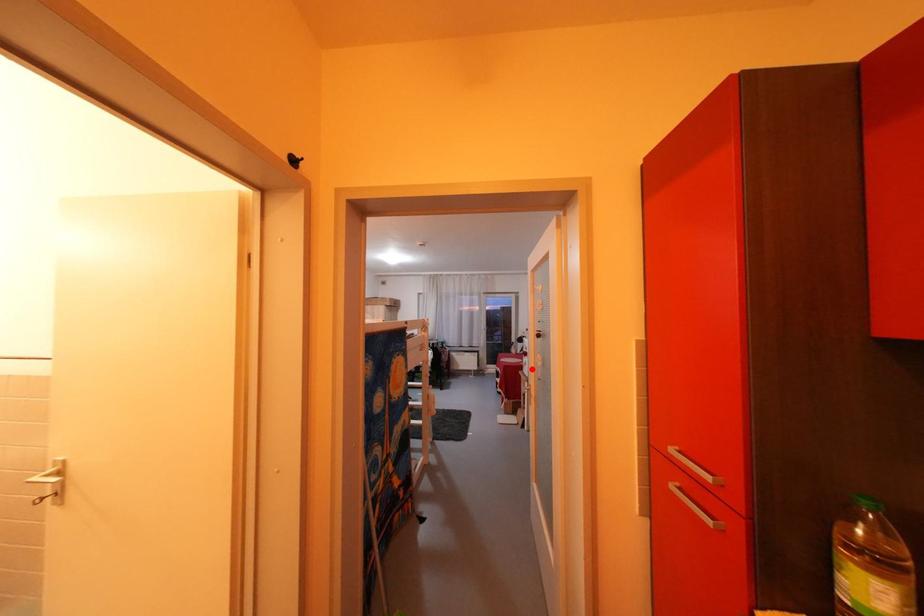
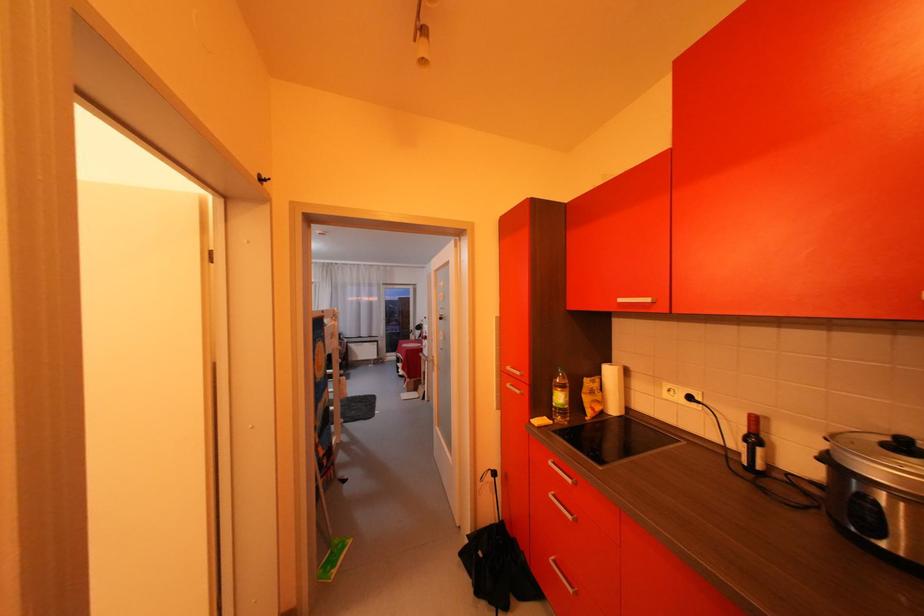
Question: I am providing you with two images of the same scene from different viewpoints. Image1 has a red point marked. In image2, the corresponding 3D location appears at what relative position? Reply with the corresponding letter.

Choices:
 (A) Closer
 (B) Farther

Answer: (B)